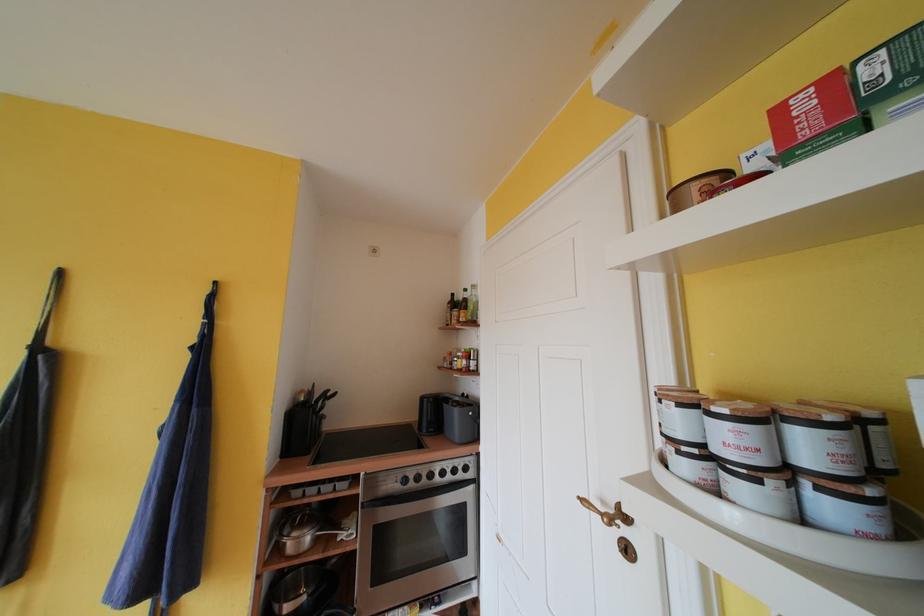
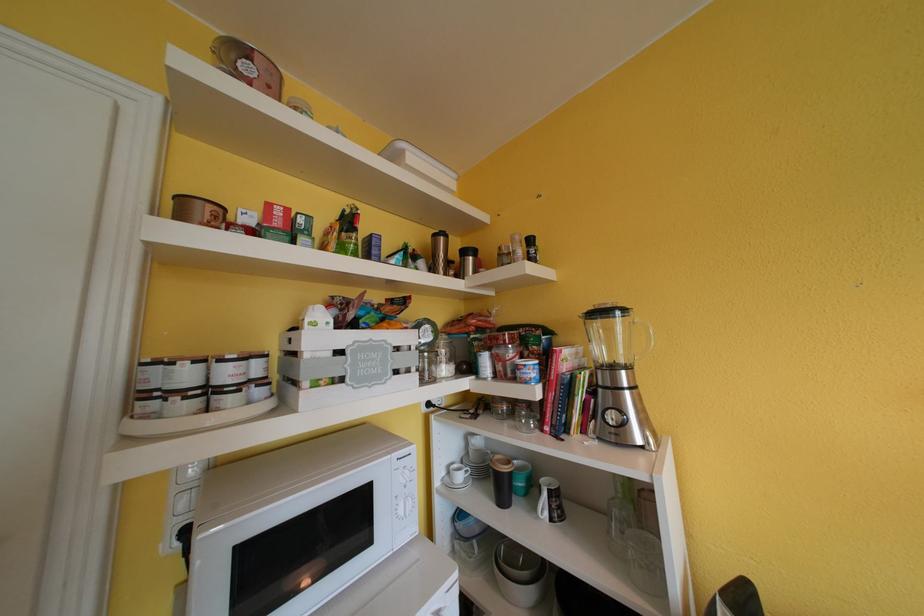
Question: The images are taken continuously from a first-person perspective. In which direction is your viewpoint rotating?

Choices:
 (A) Left
 (B) Right
 (C) Up
 (D) Down

Answer: (B)